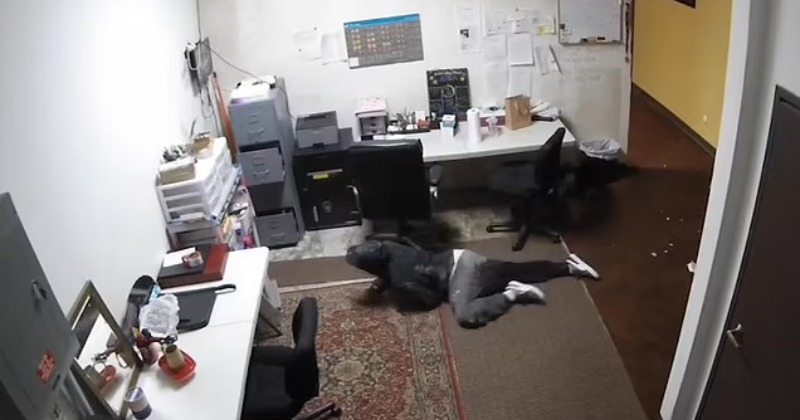
The width and height of the screenshot is (800, 420). What are the coordinates of `wall calendar` in the screenshot? It's located at (390, 44).